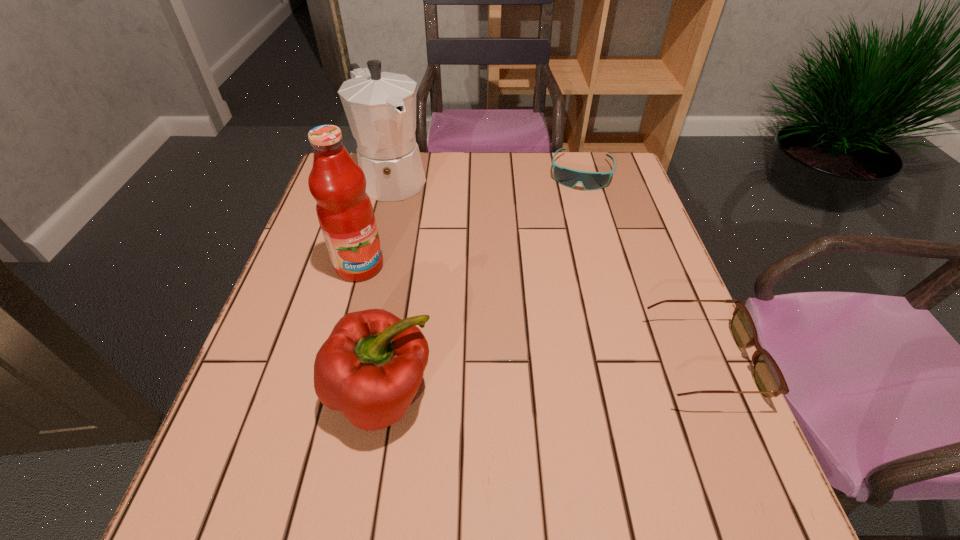
Image resolution: width=960 pixels, height=540 pixels. What are the coordinates of `coffeepot present at the left edge` in the screenshot? It's located at (380, 107).

Image resolution: width=960 pixels, height=540 pixels. Find the location of `spectacles present at the right edge`. spectacles present at the right edge is located at coordinates (767, 375).

What are the coordinates of `sunglasses present at the right edge` in the screenshot? It's located at (568, 177).

Find the location of a particular element. The width and height of the screenshot is (960, 540). object that is at the far left corner is located at coordinates (380, 107).

Identify the location of object at the far right corner. (568, 177).

At what (x,y) coordinates should I click in order to perform the action: click on object at the near right corner. Please return your answer as a coordinate pair (x, y). Looking at the image, I should click on (767, 375).

Find the location of `vacant area at the far edge`. vacant area at the far edge is located at coordinates (506, 175).

Locate an element on the screen. free space at the near edge of the desktop is located at coordinates (451, 451).

Locate an element on the screen. The width and height of the screenshot is (960, 540). free region at the left edge of the desktop is located at coordinates (317, 259).

You are a GUI agent. You are given a task and a screenshot of the screen. Output one action in this format:
    pyautogui.click(x=<x>, y=<y>)
    Task: Click on the vacant space at the right edge of the desktop
    The height and width of the screenshot is (540, 960).
    Given the screenshot: What is the action you would take?
    pyautogui.click(x=659, y=399)